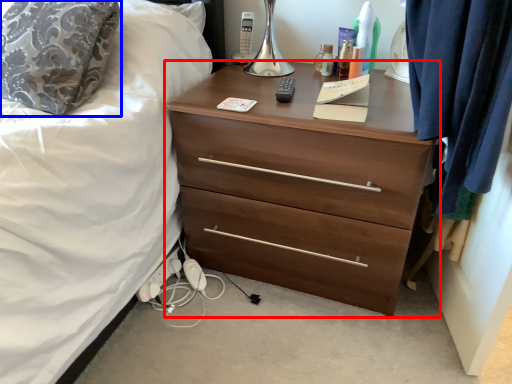
Question: Which point is closer to the camera, chest of drawers (highlighted by a red box) or pillow (highlighted by a blue box)?

Choices:
 (A) chest of drawers
 (B) pillow

Answer: (A)